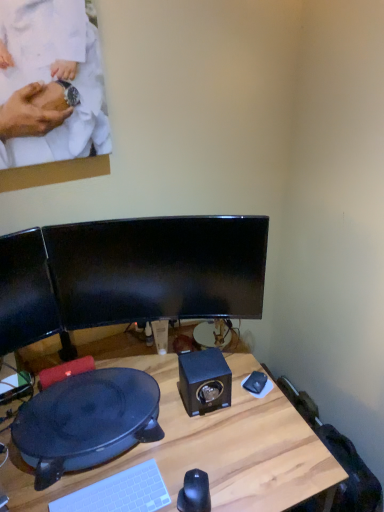
Where is `free space to the right of black matte speaker at center`? The width and height of the screenshot is (384, 512). free space to the right of black matte speaker at center is located at coordinates (259, 415).